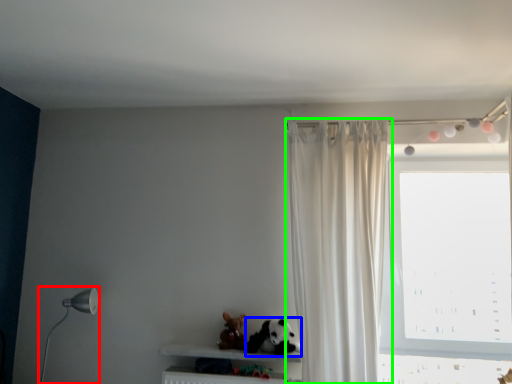
Question: Which object is the closest to the table lamp (highlighted by a red box)? Choose among these: animal (highlighted by a blue box) or curtain (highlighted by a green box).

Choices:
 (A) animal
 (B) curtain

Answer: (A)